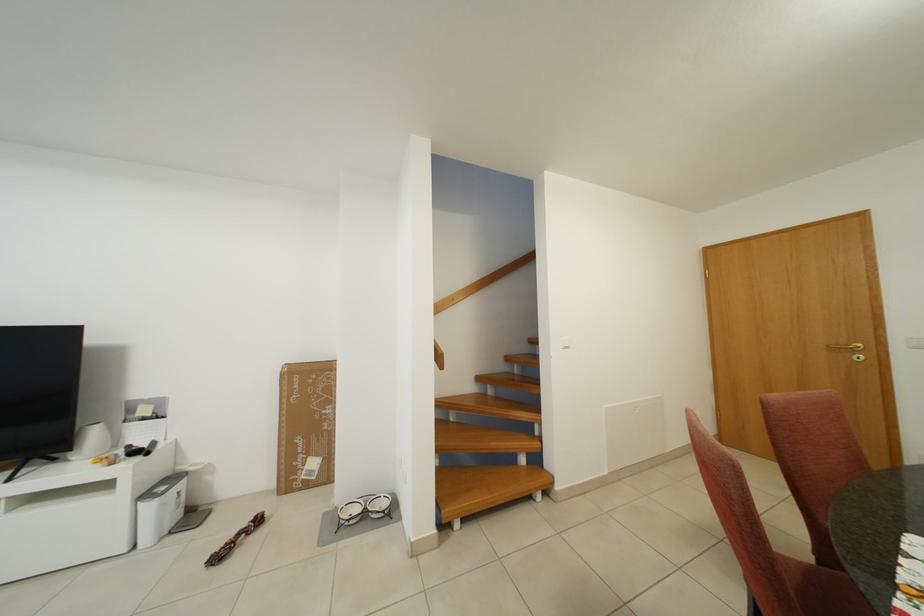
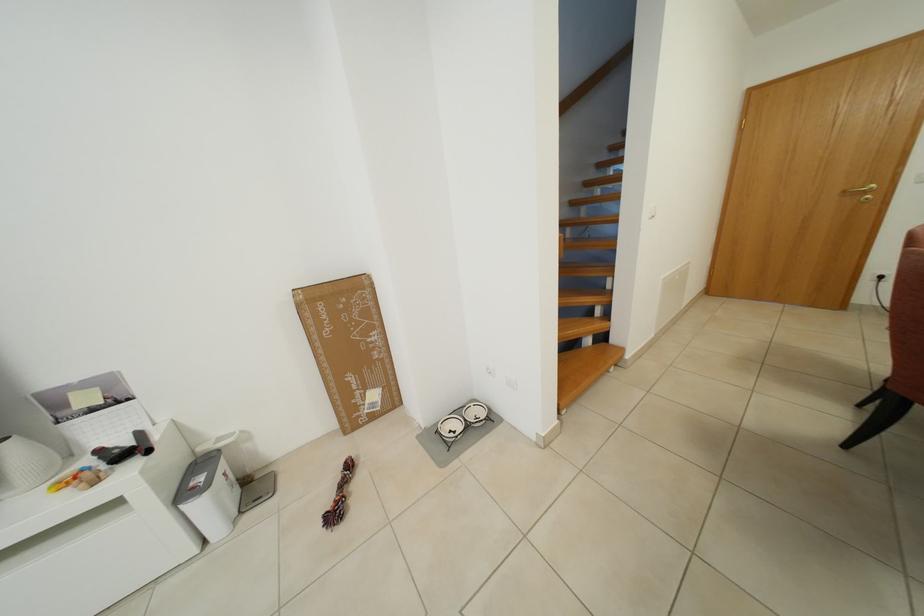
Which direction would the cameraman need to move to produce the second image?

The cameraman walked toward left, forward.